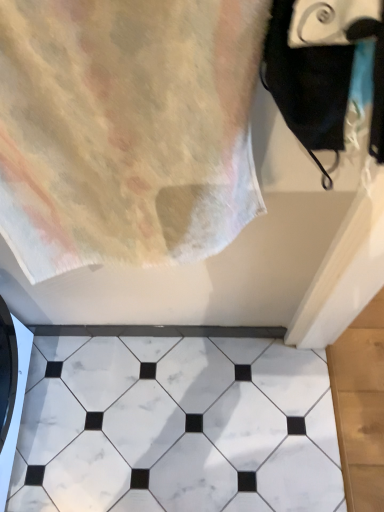
Question: Is black matte towel at upper right situated inside white marble tile at center or outside?

Choices:
 (A) outside
 (B) inside

Answer: (A)

Question: In the image, is black matte towel at upper right on the left side or the right side of white marble tile at center?

Choices:
 (A) left
 (B) right

Answer: (B)

Question: Which object is the farthest from the pastel cotton towel at upper left?

Choices:
 (A) black matte towel at upper right
 (B) white marble tile at center

Answer: (B)

Question: Estimate the real-world distances between objects in this image. Which object is farther from the white marble tile at center?

Choices:
 (A) black matte towel at upper right
 (B) pastel cotton towel at upper left

Answer: (A)